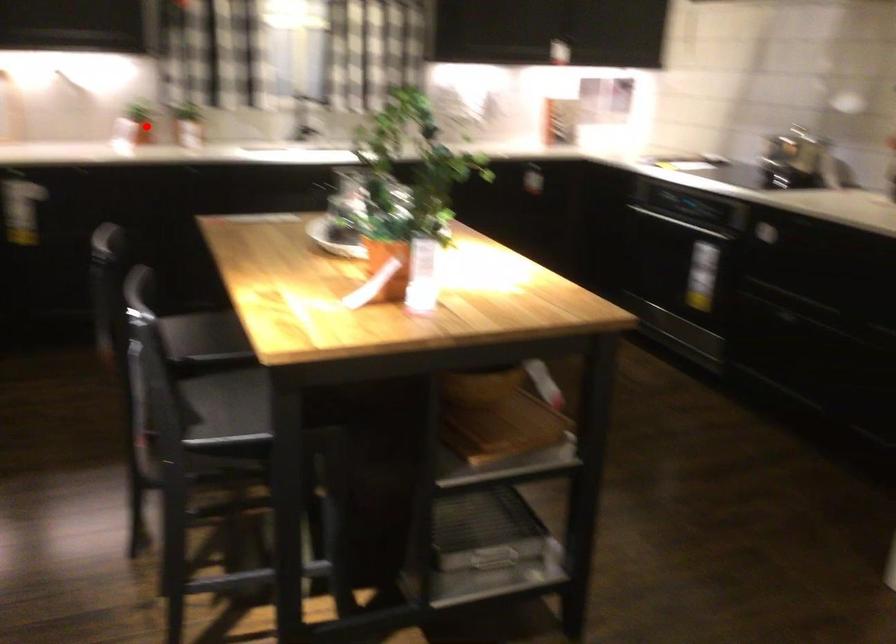
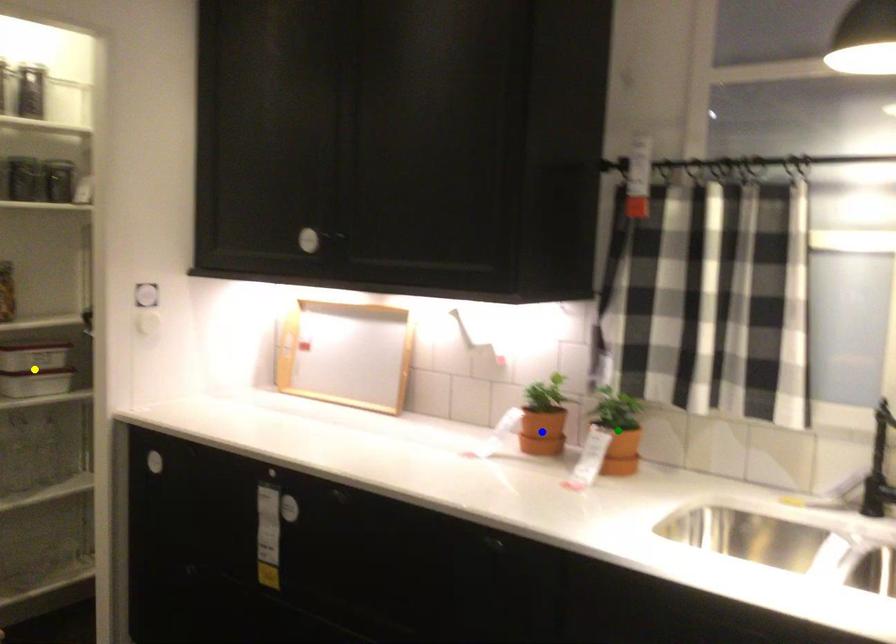
Question: I am providing you with two images of the same scene from different viewpoints. A red point is marked on the first image. You are given multiple points on the second image. Which point in image 2 represents the same 3d spot as the red point in image 1?

Choices:
 (A) blue point
 (B) green point
 (C) yellow point

Answer: (A)